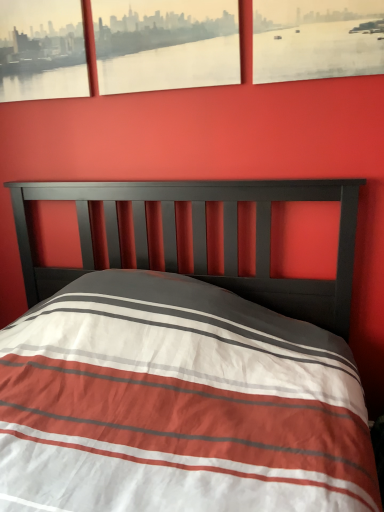
Question: Is matte paper picture frame at upper right, which is the 1th picture frame from right to left, smaller than matte paper picture frame at upper center, the second picture frame in the right-to-left sequence?

Choices:
 (A) no
 (B) yes

Answer: (B)

Question: Considering the relative sizes of matte paper picture frame at upper right, the third picture frame when ordered from left to right, and matte paper picture frame at upper center, the second picture frame in the right-to-left sequence, in the image provided, is matte paper picture frame at upper right, the third picture frame when ordered from left to right, taller than matte paper picture frame at upper center, the second picture frame in the right-to-left sequence,?

Choices:
 (A) no
 (B) yes

Answer: (A)

Question: Is the depth of matte paper picture frame at upper right, which is the 1th picture frame from right to left, less than that of matte paper picture frame at upper center, the 2th picture frame viewed from the left?

Choices:
 (A) yes
 (B) no

Answer: (A)

Question: Is matte paper picture frame at upper right, the third picture frame when ordered from left to right, thinner than matte paper picture frame at upper center, the 2th picture frame viewed from the left?

Choices:
 (A) yes
 (B) no

Answer: (A)

Question: From the image's perspective, is matte paper picture frame at upper right, which is the 1th picture frame from right to left, beneath matte paper picture frame at upper center, the 2th picture frame viewed from the left?

Choices:
 (A) yes
 (B) no

Answer: (A)

Question: Is point (190, 76) positioned closer to the camera than point (269, 51)?

Choices:
 (A) farther
 (B) closer

Answer: (A)

Question: In terms of height, does matte paper picture frame at upper center, the second picture frame in the right-to-left sequence, look taller or shorter compared to matte paper picture frame at upper right, which is the 1th picture frame from right to left?

Choices:
 (A) short
 (B) tall

Answer: (B)

Question: Is matte paper picture frame at upper center, the 2th picture frame viewed from the left, wider or thinner than matte paper picture frame at upper right, which is the 1th picture frame from right to left?

Choices:
 (A) thin
 (B) wide

Answer: (B)

Question: From the image's perspective, is matte paper picture frame at upper center, the 2th picture frame viewed from the left, above or below matte paper picture frame at upper right, which is the 1th picture frame from right to left?

Choices:
 (A) above
 (B) below

Answer: (A)

Question: Considering their positions, is matte paper picture frame at upper right, the third picture frame when ordered from left to right, located in front of or behind matte paper picture frame at upper center, the 2th picture frame viewed from the left?

Choices:
 (A) behind
 (B) front

Answer: (B)

Question: Do you think matte paper picture frame at upper right, the third picture frame when ordered from left to right, is within matte paper picture frame at upper center, the 2th picture frame viewed from the left, or outside of it?

Choices:
 (A) inside
 (B) outside

Answer: (B)

Question: From the image's perspective, is matte paper picture frame at upper right, which is the 1th picture frame from right to left, positioned above or below matte paper picture frame at upper center, the second picture frame in the right-to-left sequence?

Choices:
 (A) below
 (B) above

Answer: (A)

Question: Is matte paper picture frame at upper right, the third picture frame when ordered from left to right, bigger or smaller than matte paper picture frame at upper center, the second picture frame in the right-to-left sequence?

Choices:
 (A) big
 (B) small

Answer: (B)

Question: Choose the correct answer: Is matte black picture frame at upper left, acting as the first picture frame starting from the left, inside matte paper picture frame at upper right, which is the 1th picture frame from right to left, or outside it?

Choices:
 (A) inside
 (B) outside

Answer: (B)

Question: From a real-world perspective, is matte black picture frame at upper left, the third picture frame viewed from the right, above or below matte paper picture frame at upper right, which is the 1th picture frame from right to left?

Choices:
 (A) above
 (B) below

Answer: (A)